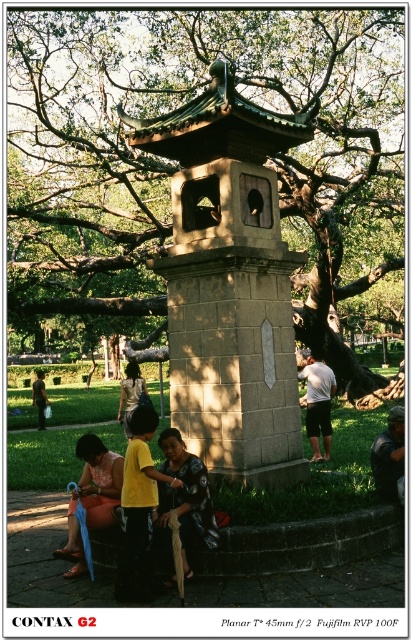
Does green leafy tree at center have a greater height compared to white cotton shirt at center?

Indeed, green leafy tree at center has a greater height compared to white cotton shirt at center.

Is green leafy tree at center thinner than white cotton shirt at center?

No.

Who is more forward, [309,220] or [332,381]?

Positioned in front is point [332,381].

At what (x,y) coordinates should I click in order to perform the action: click on green leafy tree at center. Please return your answer as a coordinate pair (x, y). Looking at the image, I should click on (179, 166).

Is green leafy tree at center positioned in front of matte orange dress at lower left?

No, green leafy tree at center is behind matte orange dress at lower left.

The image size is (411, 640). What do you see at coordinates (179, 166) in the screenshot?
I see `green leafy tree at center` at bounding box center [179, 166].

Find the location of `green leafy tree at center`. green leafy tree at center is located at coordinates (179, 166).

Is green leafy tree at center above dark blue fabric at lower right?

Correct, green leafy tree at center is located above dark blue fabric at lower right.

Which is more to the left, green leafy tree at center or dark blue fabric at lower right?

Positioned to the left is green leafy tree at center.

Is point (163, 291) positioned behind point (385, 467)?

That is True.

This screenshot has height=640, width=411. Find the location of `green leafy tree at center`. green leafy tree at center is located at coordinates (179, 166).